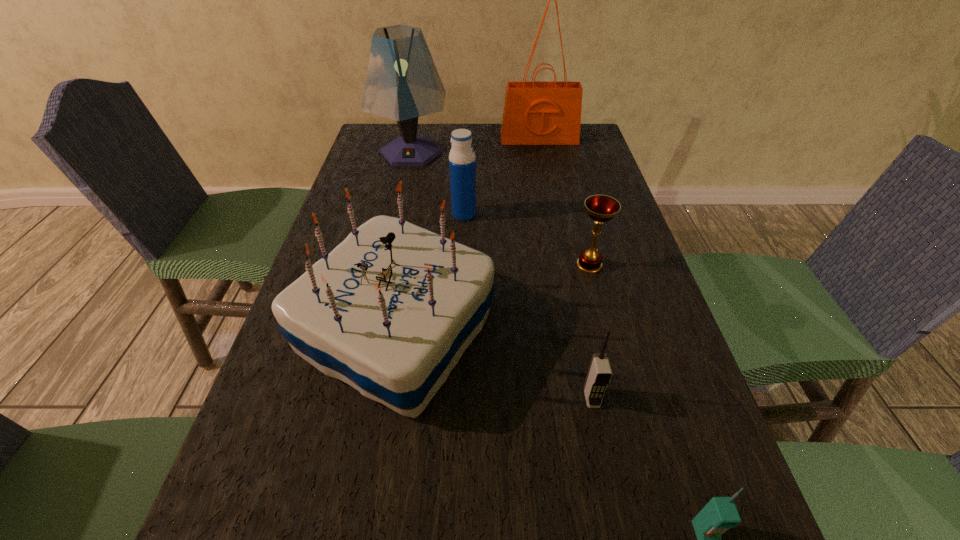
The image size is (960, 540). Identify the location of free spot located 0.060m on the back of the fifth shortest object. (411, 246).

Find the location of `free space located on the right of the fourth tallest object`. free space located on the right of the fourth tallest object is located at coordinates (592, 214).

This screenshot has width=960, height=540. In order to click on vacant space located 0.150m on the front-facing side of the taller cellular telephone in this screenshot , I will do pyautogui.click(x=612, y=500).

Identify the location of free space located on the right of the chalice. The height and width of the screenshot is (540, 960). (643, 265).

Where is `tote bag at the far edge`? The width and height of the screenshot is (960, 540). tote bag at the far edge is located at coordinates (535, 113).

What are the coordinates of `lampshade that is at the far edge` in the screenshot? It's located at click(x=402, y=83).

The width and height of the screenshot is (960, 540). I want to click on lampshade located in the left edge section of the desktop, so click(402, 83).

You are a GUI agent. You are given a task and a screenshot of the screen. Output one action in this format:
    pyautogui.click(x=<x>, y=<y>)
    Task: Click on the birthday cake that is at the left edge
    
    Given the screenshot: What is the action you would take?
    pyautogui.click(x=390, y=311)

Identify the location of tote bag located in the right edge section of the desktop. The image size is (960, 540). (535, 113).

The image size is (960, 540). I want to click on chalice that is positioned at the right edge, so click(601, 208).